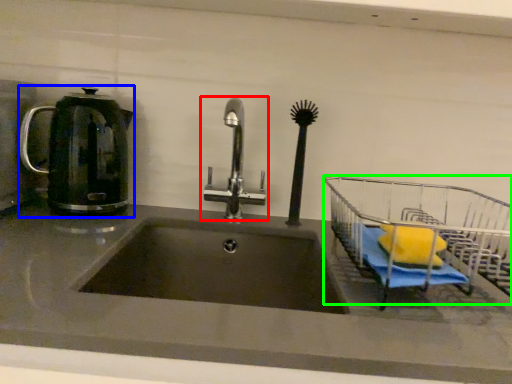
Question: Based on their relative distances, which object is nearer to tap (highlighted by a red box)? Choose from kettle (highlighted by a blue box) and cart (highlighted by a green box).

Choices:
 (A) kettle
 (B) cart

Answer: (A)